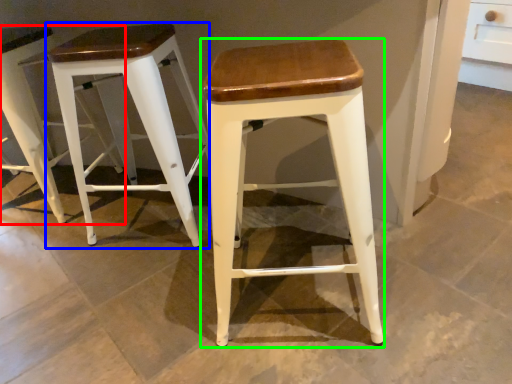
Question: Which is nearer to the stool (highlighted by a red box)? stool (highlighted by a blue box) or stool (highlighted by a green box).

Choices:
 (A) stool
 (B) stool

Answer: (A)